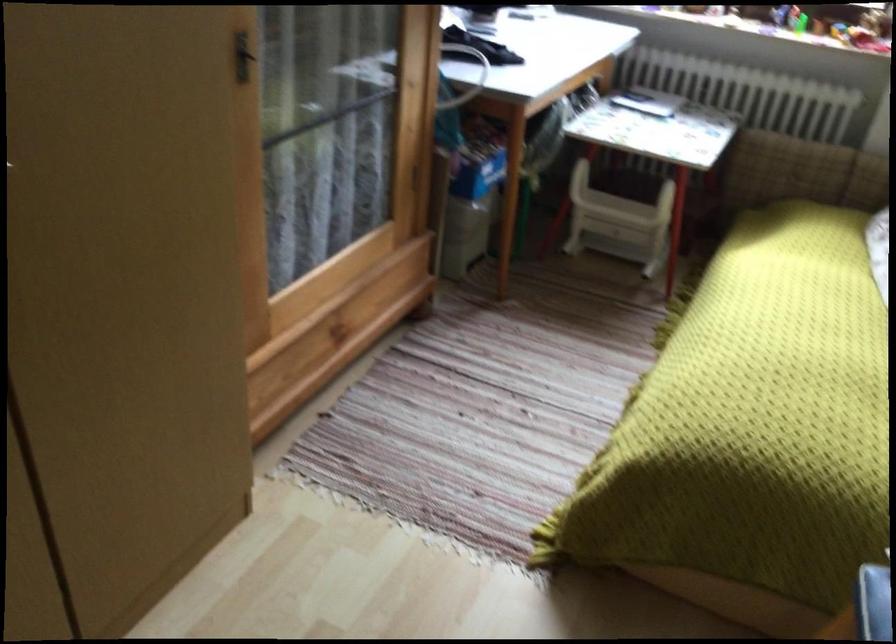
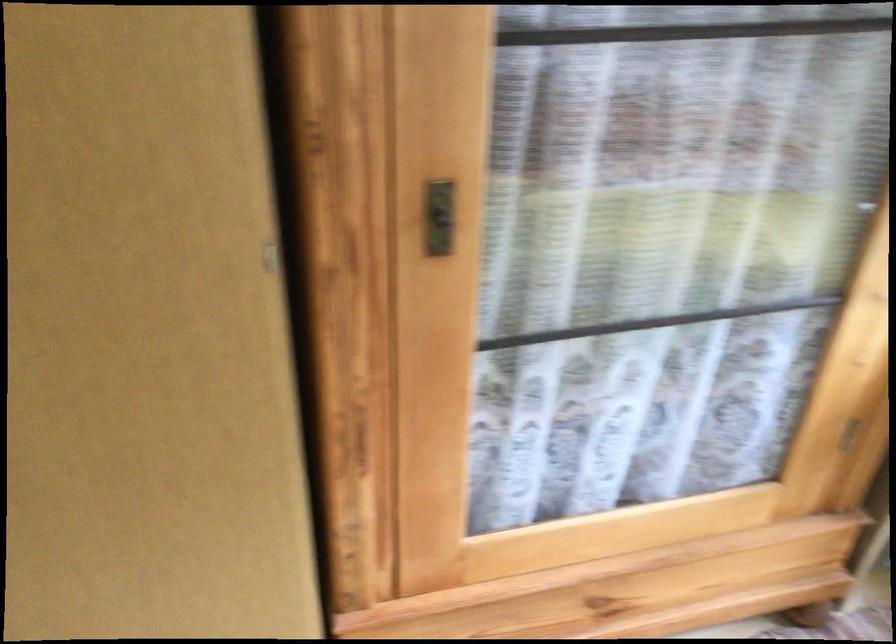
Question: The first image is from the beginning of the video and the second image is from the end. How did the camera likely rotate when shooting the video?

Choices:
 (A) Left
 (B) Right
 (C) Up
 (D) Down

Answer: (A)